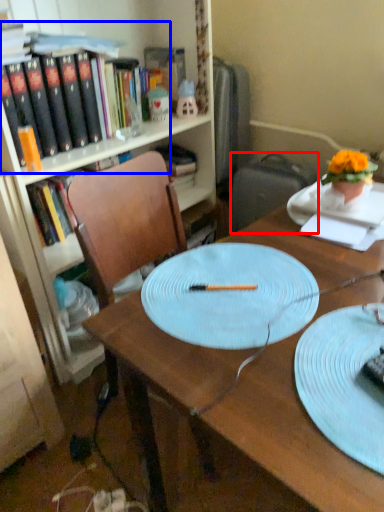
Question: Which of the following is the farthest to the observer, suitcase (highlighted by a red box) or book (highlighted by a blue box)?

Choices:
 (A) suitcase
 (B) book

Answer: (A)